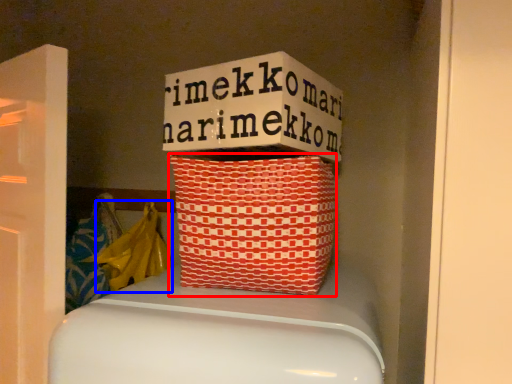
Question: Which object appears farthest to the camera in this image, basket (highlighted by a red box) or material (highlighted by a blue box)?

Choices:
 (A) basket
 (B) material

Answer: (B)